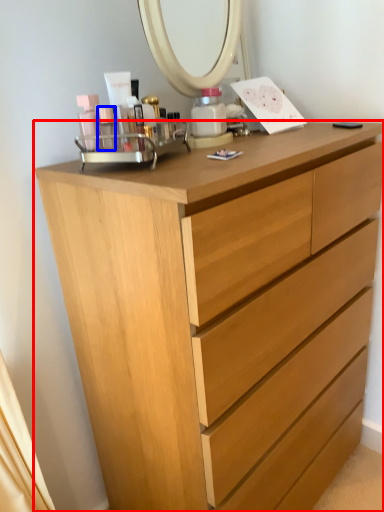
Question: Which of the following is the closest to the observer, chest of drawers (highlighted by a red box) or toiletry (highlighted by a blue box)?

Choices:
 (A) chest of drawers
 (B) toiletry

Answer: (A)